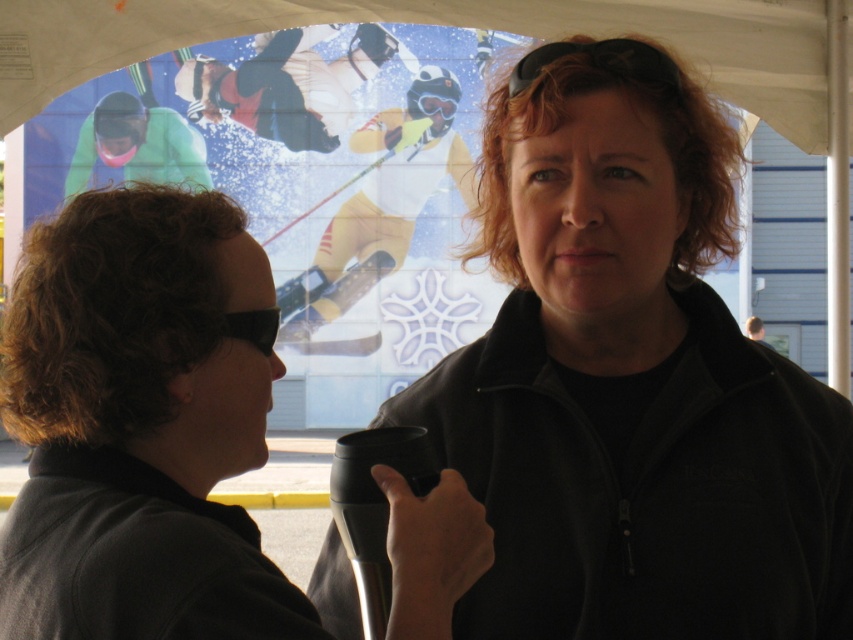
You are a photographer trying to capture the matte black snowboarder at upper center in your shot. The camera you are using has a field of view that covers a rectangle from point A at the bottom left corner to point B at the top right corner of the image. Given that the snowboarder is located at point C at coordinates 0.134, 0.339, will the snowboarder be within the camera frame?

The matte black snowboarder at upper center is located at point C at coordinates (288,84). Since the camera frame covers from point A at the bottom left to point B at the top right, the snowboarder at point C would be within the camera frame as its coordinates fall within the rectangle defined by points A and B.

You are standing at the point marked by the coordinates point (x=338, y=28). You want to walk towards the large mural or advertisement in the background. How far will you have to walk to reach the mural?

The point (x=338, y=28) is 32.90 meters away from the viewer, so you would need to walk 32.90 meters to reach the mural.